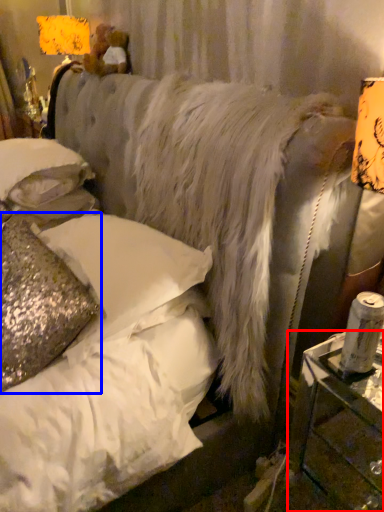
Question: Which point is closer to the camera, table (highlighted by a red box) or pillow (highlighted by a blue box)?

Choices:
 (A) table
 (B) pillow

Answer: (A)